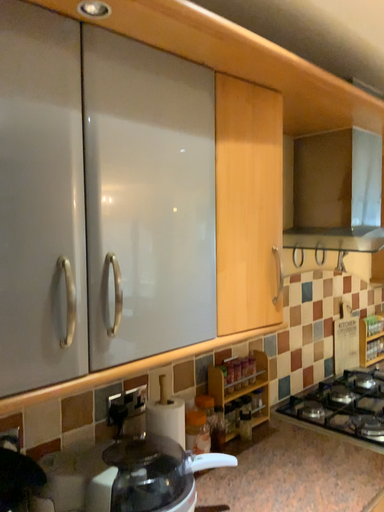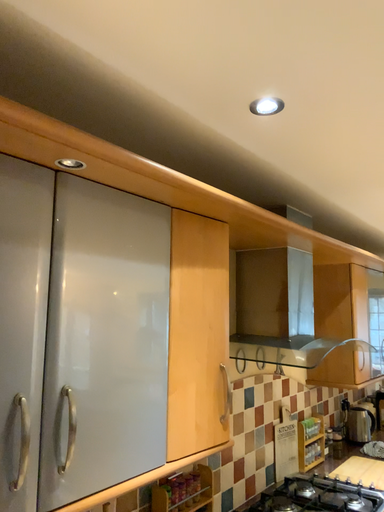
Question: How did the camera likely rotate when shooting the video?

Choices:
 (A) rotated left
 (B) rotated right

Answer: (B)